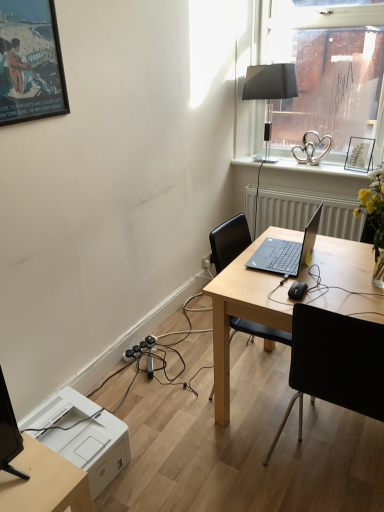
The image size is (384, 512). Identify the location of free point below black fabric lampshade at upper right (from a real-world perspective). (269, 158).